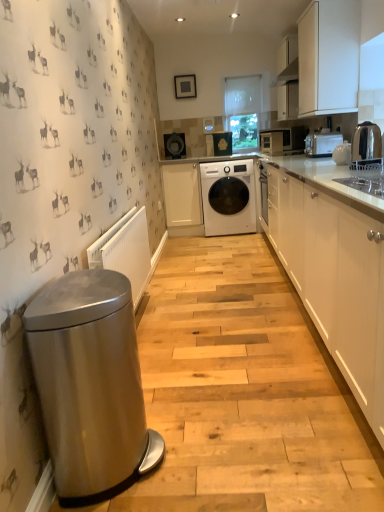
Question: Can you confirm if matte black washing machine at center, positioned as the fourth appliance in right-to-left order, is thinner than white ceramic teapot at upper right, the 1th appliance when ordered from right to left?

Choices:
 (A) no
 (B) yes

Answer: (A)

Question: Can you confirm if matte black washing machine at center, positioned as the fourth appliance in right-to-left order, is positioned to the left of white ceramic teapot at upper right, the 4th appliance from the top?

Choices:
 (A) no
 (B) yes

Answer: (B)

Question: Does matte black washing machine at center, positioned as the fourth appliance in right-to-left order, have a larger size compared to white ceramic teapot at upper right, the 4th appliance from the top?

Choices:
 (A) no
 (B) yes

Answer: (B)

Question: Are matte black washing machine at center, which appears as the third appliance when viewed from the front, and white ceramic teapot at upper right, the 4th appliance from the top, located far from each other?

Choices:
 (A) yes
 (B) no

Answer: (A)

Question: Is matte black washing machine at center, which appears as the third appliance when viewed from the front, surrounding white ceramic teapot at upper right, arranged as the 1th appliance when ordered from the bottom?

Choices:
 (A) yes
 (B) no

Answer: (B)

Question: From the image's perspective, is matte black washing machine at center, arranged as the 2th appliance when viewed from the back, over white ceramic teapot at upper right, the 1th appliance when ordered from right to left?

Choices:
 (A) no
 (B) yes

Answer: (B)

Question: Is white ceramic teapot at upper right, the 1th appliance when ordered from right to left, far away from white plastic radiator at lower left?

Choices:
 (A) no
 (B) yes

Answer: (B)

Question: Is white ceramic teapot at upper right, the 1th appliance when ordered from right to left, bigger than white plastic radiator at lower left?

Choices:
 (A) no
 (B) yes

Answer: (A)

Question: Considering the relative sizes of white ceramic teapot at upper right, the 1th appliance when ordered from right to left, and white plastic radiator at lower left in the image provided, is white ceramic teapot at upper right, the 1th appliance when ordered from right to left, wider than white plastic radiator at lower left?

Choices:
 (A) no
 (B) yes

Answer: (B)

Question: Is white plastic radiator at lower left inside white ceramic teapot at upper right, which is the 4th appliance in back-to-front order?

Choices:
 (A) no
 (B) yes

Answer: (A)

Question: From the image's perspective, is white ceramic teapot at upper right, the 4th appliance from the top, over white plastic radiator at lower left?

Choices:
 (A) no
 (B) yes

Answer: (B)

Question: Can you confirm if white ceramic teapot at upper right, the 4th appliance from the top, is taller than white plastic radiator at lower left?

Choices:
 (A) no
 (B) yes

Answer: (A)

Question: From a real-world perspective, is metallic silver toaster at upper right, the second home appliance positioned from the back, below matte black microwave at upper right, the first home appliance viewed from the back?

Choices:
 (A) no
 (B) yes

Answer: (B)